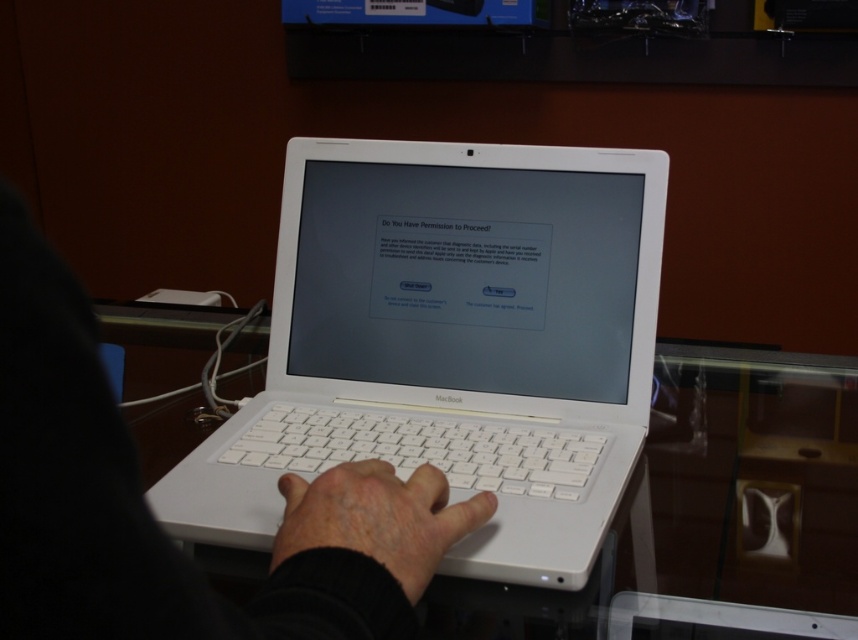
Question: Which point appears farthest from the camera in this image?

Choices:
 (A) (780, 356)
 (B) (508, 449)
 (C) (591, 410)

Answer: (A)

Question: Does white plastic laptop at center appear under white matte hand at center?

Choices:
 (A) yes
 (B) no

Answer: (B)

Question: Based on their relative distances, which object is nearer to the white plastic keyboard at center?

Choices:
 (A) white plastic laptop at center
 (B) white matte hand at center

Answer: (A)

Question: Is white plastic laptop at center bigger than white plastic keyboard at center?

Choices:
 (A) yes
 (B) no

Answer: (A)

Question: Can you confirm if white glossy table at center is positioned above white matte laptop at center?

Choices:
 (A) yes
 (B) no

Answer: (A)

Question: Estimate the real-world distances between objects in this image. Which object is farther from the white plastic keyboard at center?

Choices:
 (A) white matte hand at center
 (B) white glossy table at center
 (C) white plastic laptop at center

Answer: (B)